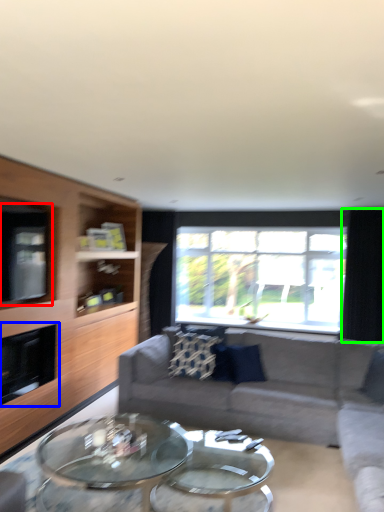
Question: Which object is positioned farthest from window screen (highlighted by a red box)? Select from fireplace (highlighted by a blue box) and curtain (highlighted by a green box).

Choices:
 (A) fireplace
 (B) curtain

Answer: (B)